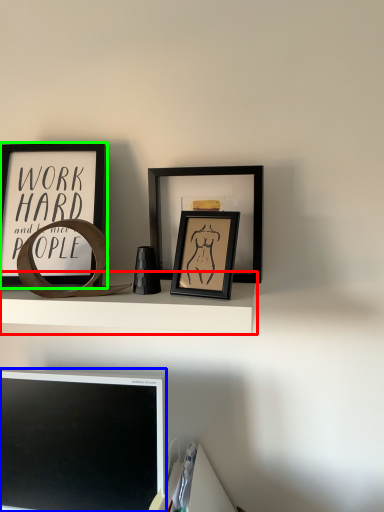
Question: Based on their relative distances, which object is farther from shelf (highlighted by a red box)? Choose from computer monitor (highlighted by a blue box) and picture frame (highlighted by a green box).

Choices:
 (A) computer monitor
 (B) picture frame

Answer: (A)